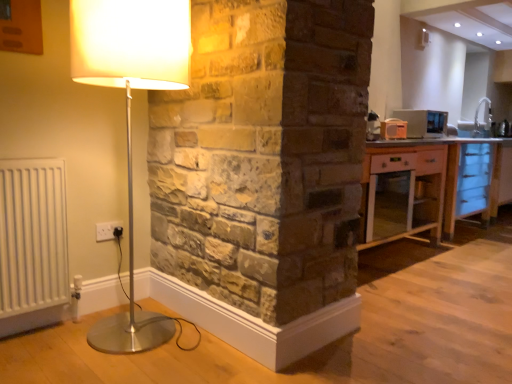
Question: Based on their sizes in the image, would you say light wood cabinet at right is bigger or smaller than white ceramic sink at upper right?

Choices:
 (A) small
 (B) big

Answer: (B)

Question: In terms of height, does light wood cabinet at right look taller or shorter compared to white ceramic sink at upper right?

Choices:
 (A) tall
 (B) short

Answer: (A)

Question: Based on their relative distances, which object is nearer to the matte white lamp at left?

Choices:
 (A) white ceramic sink at upper right
 (B) metallic silver microwave at upper right
 (C) light wood cabinet at right

Answer: (C)

Question: Based on their relative distances, which object is farther from the white ceramic sink at upper right?

Choices:
 (A) matte white lamp at left
 (B) metallic silver microwave at upper right
 (C) light wood cabinet at right

Answer: (A)